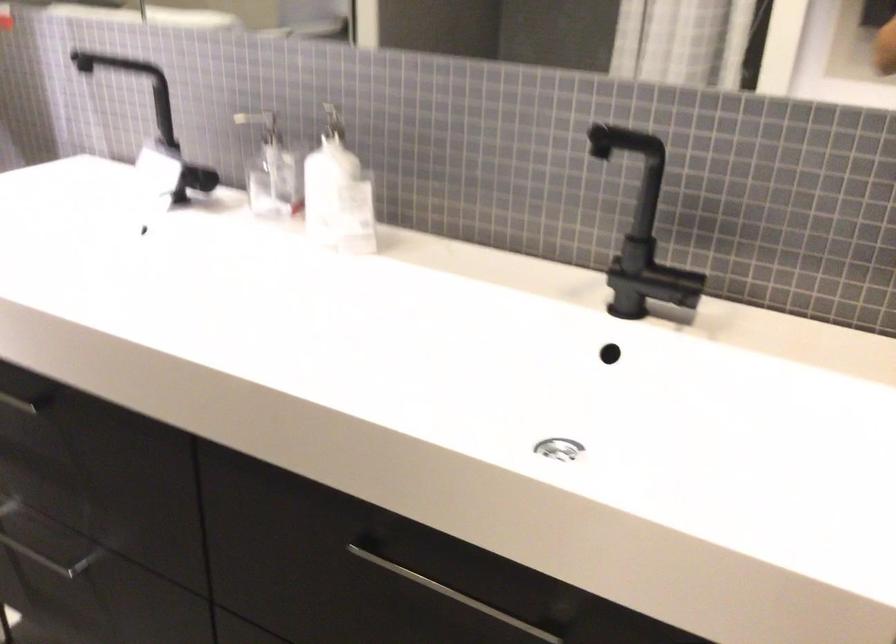
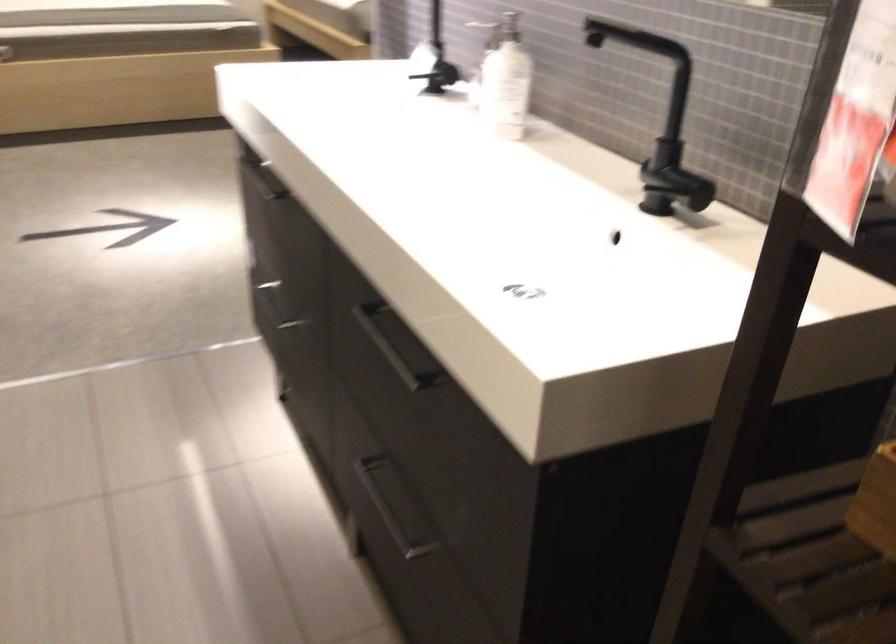
The point at (204, 185) is marked in the first image. Where is the corresponding point in the second image?

(440, 77)